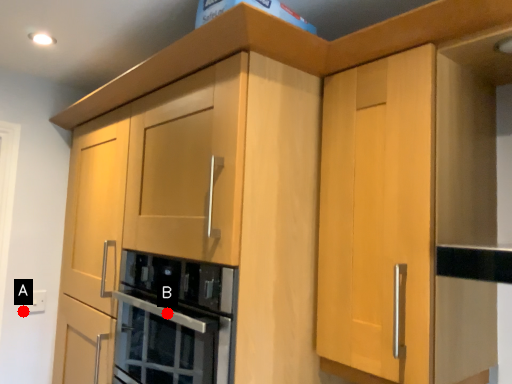
Question: Two points are circled on the image, labeled by A and B beside each circle. Which point is further to the camera?

Choices:
 (A) A is further
 (B) B is further

Answer: (A)